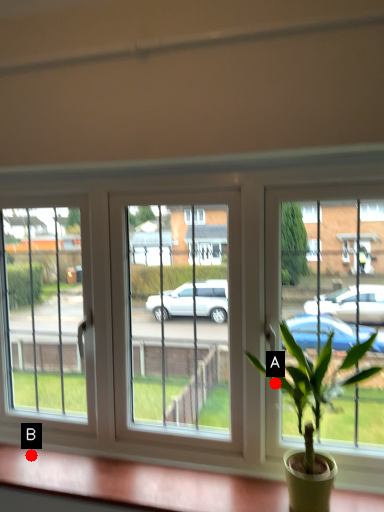
Question: Two points are circled on the image, labeled by A and B beside each circle. Which point is farther to the camera?

Choices:
 (A) A is further
 (B) B is further

Answer: (B)